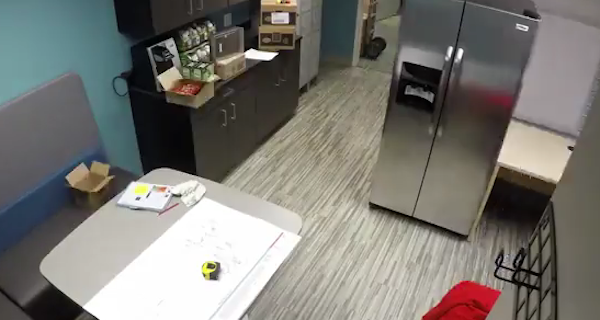
The width and height of the screenshot is (600, 320). Identify the location of pull here to open refrigerator. (441, 88), (449, 89).